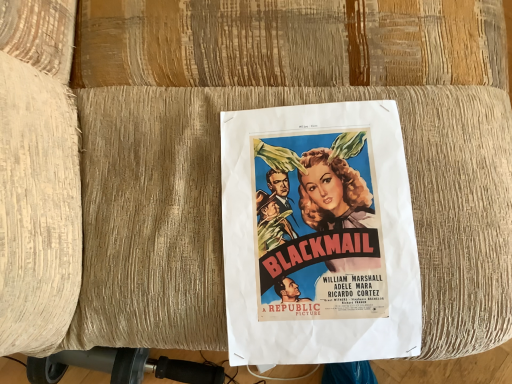
Question: Relative to vintage paper poster at center, is black rubber vacuum at lower left in front or behind?

Choices:
 (A) behind
 (B) front

Answer: (A)

Question: Considering the positions of black rubber vacuum at lower left and vintage paper poster at center in the image, is black rubber vacuum at lower left bigger or smaller than vintage paper poster at center?

Choices:
 (A) big
 (B) small

Answer: (B)

Question: Do you think black rubber vacuum at lower left is within vintage paper poster at center, or outside of it?

Choices:
 (A) outside
 (B) inside

Answer: (A)

Question: Is vintage paper poster at center taller or shorter than black rubber vacuum at lower left?

Choices:
 (A) tall
 (B) short

Answer: (B)

Question: Is vintage paper poster at center wider or thinner than black rubber vacuum at lower left?

Choices:
 (A) thin
 (B) wide

Answer: (A)

Question: Would you say vintage paper poster at center is to the left or to the right of black rubber vacuum at lower left in the picture?

Choices:
 (A) right
 (B) left

Answer: (A)

Question: Is vintage paper poster at center inside the boundaries of black rubber vacuum at lower left, or outside?

Choices:
 (A) inside
 (B) outside

Answer: (B)